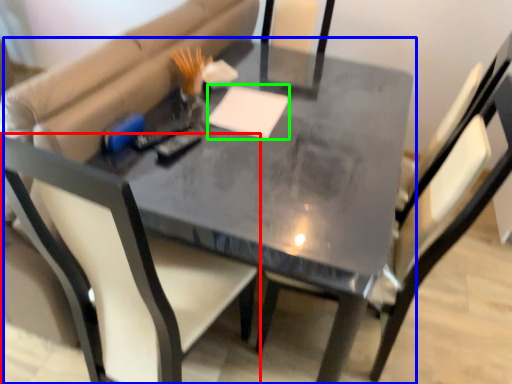
Question: Which object is positioned closest to chair (highlighted by a red box)? Select from table (highlighted by a blue box) and notepad (highlighted by a green box).

Choices:
 (A) table
 (B) notepad

Answer: (A)